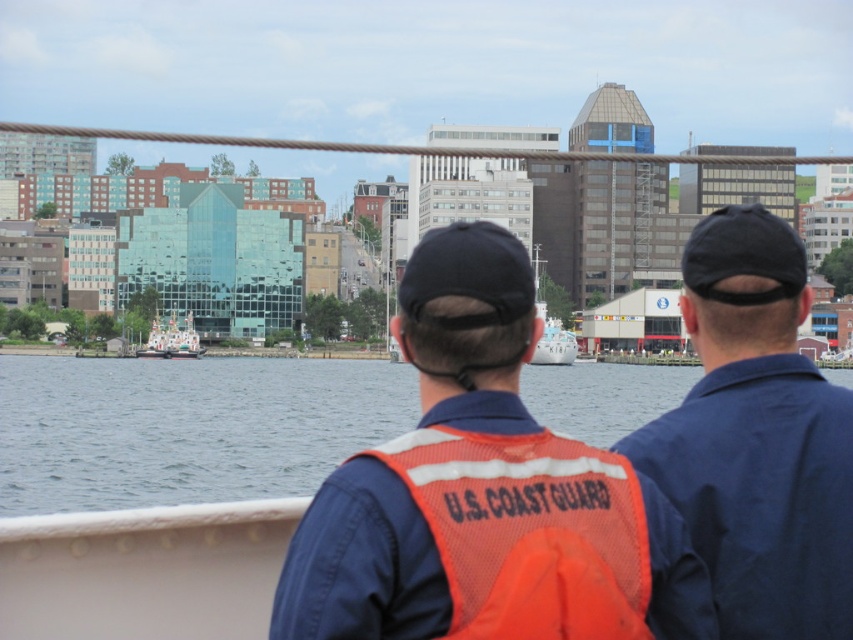
Question: Is blue water at center wider than white glossy float at center?

Choices:
 (A) yes
 (B) no

Answer: (A)

Question: Does white glossy float at center have a smaller size compared to white glossy boat at center?

Choices:
 (A) no
 (B) yes

Answer: (B)

Question: Estimate the real-world distances between objects in this image. Which object is closer to the orange mesh vest at center?

Choices:
 (A) white glossy boat at center
 (B) blue water at center
 (C) orange mesh safety vest at center

Answer: (C)

Question: Which point is farther to the camera?

Choices:
 (A) (468, 486)
 (B) (573, 486)

Answer: (B)

Question: Does blue uniform at center have a larger size compared to white glossy float at center?

Choices:
 (A) yes
 (B) no

Answer: (B)

Question: Which point is farther from the camera taking this photo?

Choices:
 (A) (804, 461)
 (B) (451, 458)
 (C) (299, 381)
 (D) (331, 509)

Answer: (C)